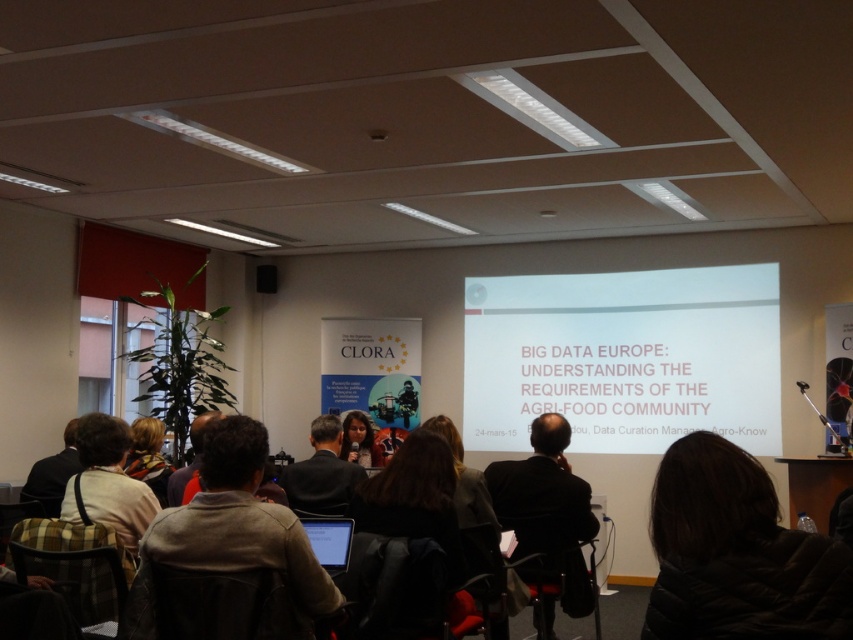
Between dark brown leather jacket at lower left and multicolored scarf at center, which one is positioned higher?

multicolored scarf at center

Consider the image. Does dark brown leather jacket at lower left appear on the left side of multicolored scarf at center?

Correct, you'll find dark brown leather jacket at lower left to the left of multicolored scarf at center.

What do you see at coordinates (53, 474) in the screenshot? I see `dark brown leather jacket at lower left` at bounding box center [53, 474].

Locate an element on the screen. The image size is (853, 640). dark brown leather jacket at lower left is located at coordinates (53, 474).

Does black puffer jacket at lower right appear on the right side of multicolored scarf at center?

Correct, you'll find black puffer jacket at lower right to the right of multicolored scarf at center.

Who is shorter, black puffer jacket at lower right or multicolored scarf at center?

With less height is multicolored scarf at center.

Based on the photo, who is more forward, (654, 502) or (158, 496)?

Positioned in front is point (654, 502).

Find the location of `black puffer jacket at lower right`. black puffer jacket at lower right is located at coordinates (735, 554).

Can you confirm if white matte projector screen at center is shorter than black puffer jacket at lower right?

No, white matte projector screen at center is not shorter than black puffer jacket at lower right.

Can you confirm if white matte projector screen at center is wider than black puffer jacket at lower right?

Yes, white matte projector screen at center is wider than black puffer jacket at lower right.

Which is behind, point (537, 372) or point (741, 608)?

Point (537, 372)

Where is `white matte projector screen at center`? The height and width of the screenshot is (640, 853). white matte projector screen at center is located at coordinates (624, 356).